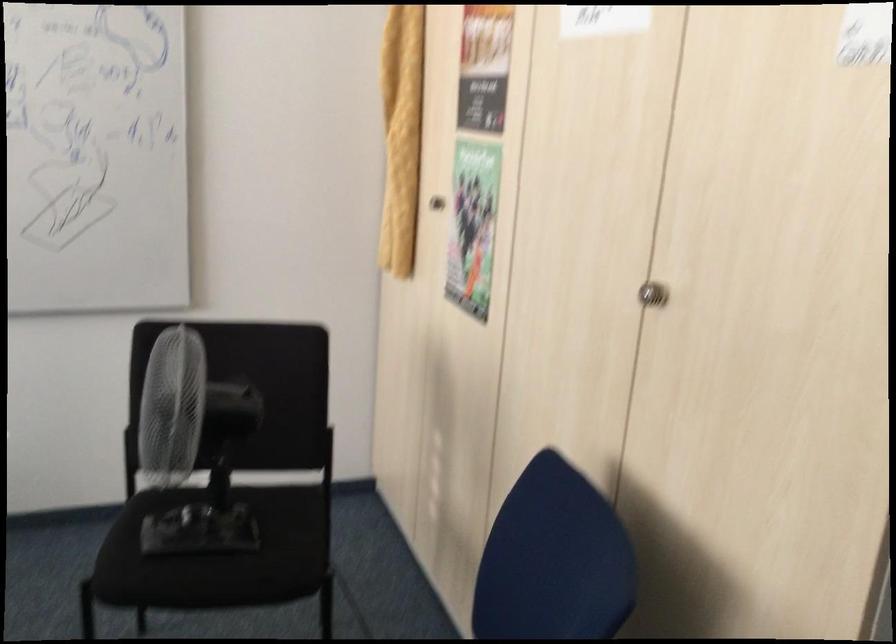
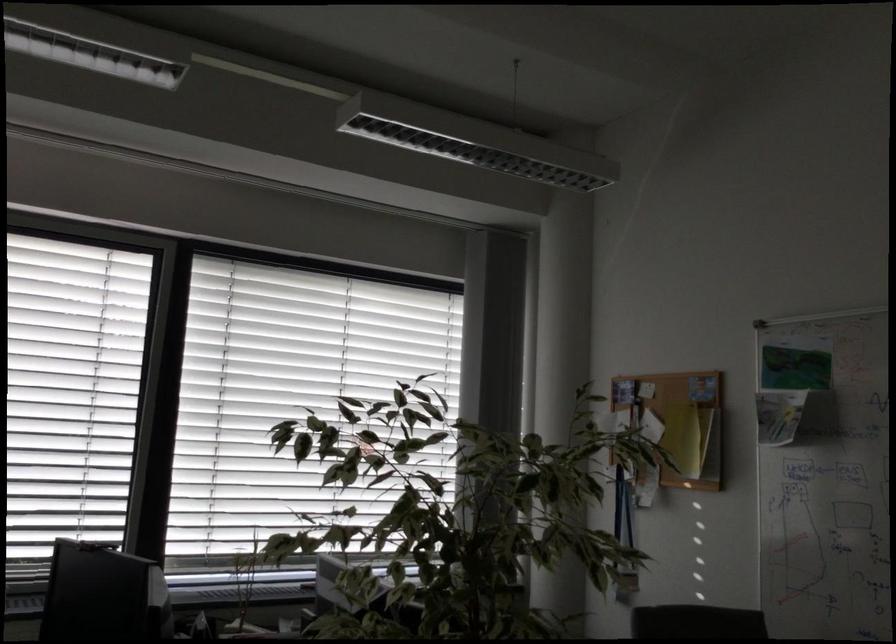
The first image is from the beginning of the video and the second image is from the end. How did the camera likely rotate when shooting the video?

The rotation direction of the camera is left-up.